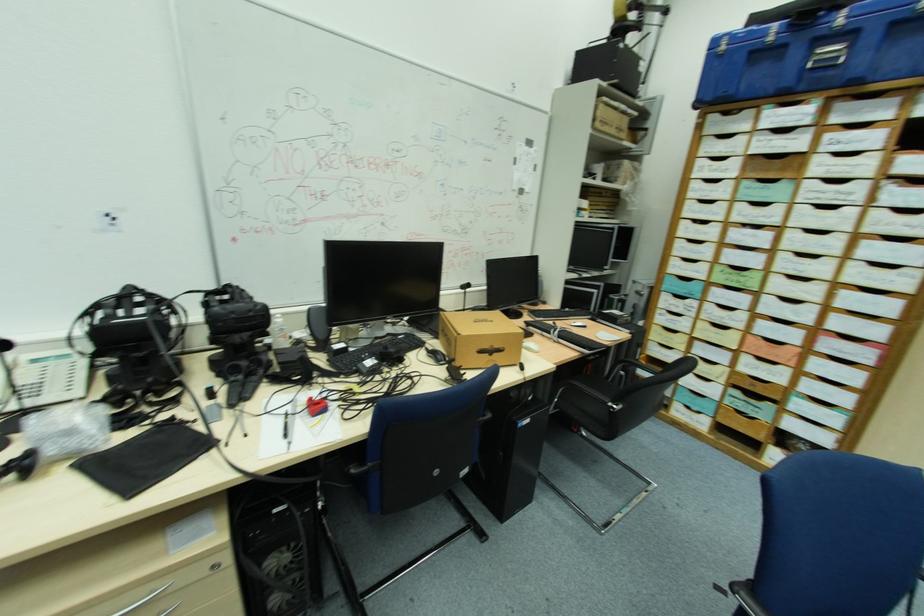
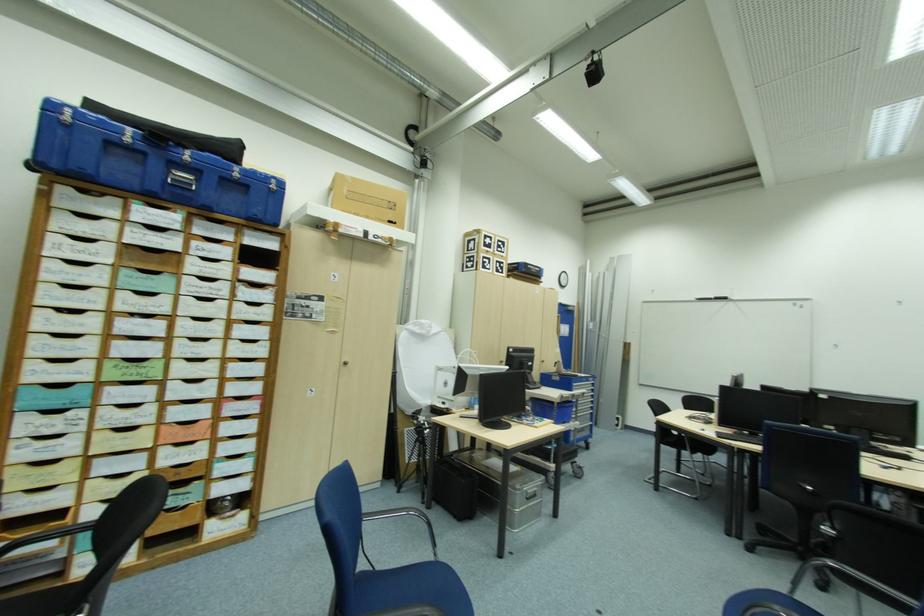
Question: The images are taken continuously from a first-person perspective. In which direction is your viewpoint rotating?

Choices:
 (A) Left
 (B) Right
 (C) Up
 (D) Down

Answer: (B)